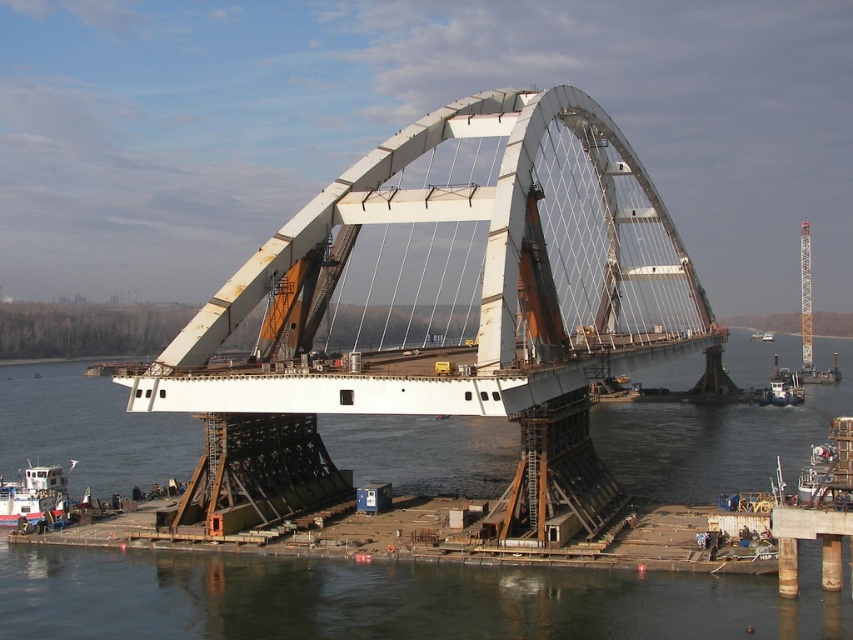
Can you confirm if dark gray water at center is positioned below blue painted steel boat at lower left?

No.

Is dark gray water at center bigger than blue painted steel boat at lower left?

Yes, dark gray water at center is bigger than blue painted steel boat at lower left.

Locate an element on the screen. The image size is (853, 640). dark gray water at center is located at coordinates (392, 600).

Is white metallic arch bridge at center smaller than white metallic crane at right?

Actually, white metallic arch bridge at center might be larger than white metallic crane at right.

Is point (405, 218) positioned behind point (809, 332)?

No.

Between point (256, 476) and point (810, 364), which one is positioned in front?

Positioned in front is point (256, 476).

This screenshot has height=640, width=853. What are the coordinates of `white metallic arch bridge at center` in the screenshot? It's located at (448, 312).

Can you confirm if dark gray water at center is thinner than white matte boat at lower right?

In fact, dark gray water at center might be wider than white matte boat at lower right.

Is point (679, 477) less distant than point (792, 396)?

Yes.

Locate an element on the screen. dark gray water at center is located at coordinates (392, 600).